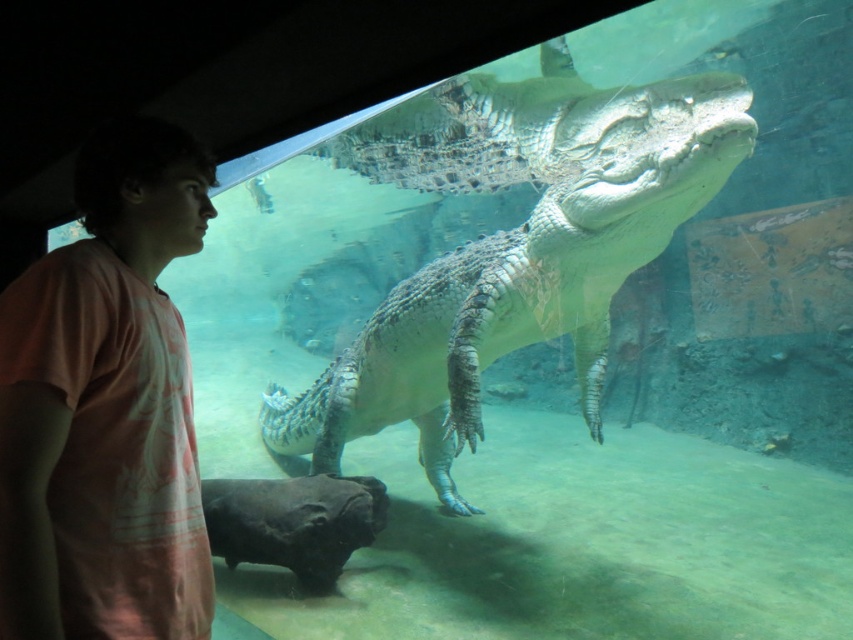
You are a visitor at the aquarium and want to take a photo of the gray textured crocodile at center without the pink cotton shirt at left appearing in the frame. Is it possible to do so by adjusting your camera angle?

The gray textured crocodile at center is taller than the pink cotton shirt at left, so by angling the camera upwards to focus on the crocodile, you can avoid including the pink cotton shirt at left in the frame.

You are standing at the point marked by the coordinates (512, 244) in the image. What object are you closest to?

You are closest to the gray textured crocodile at center, as the coordinates point directly to it.

You are standing in the aquarium and want to take a photo of the crocodile. You notice two points marked in the scene. The first point is at coordinate point (480, 164) and the second is at point (32, 579). Which point is closer to you, the observer?

Point (480, 164) is further to the viewer than point (32, 579), so the point closer to you is point (32, 579).